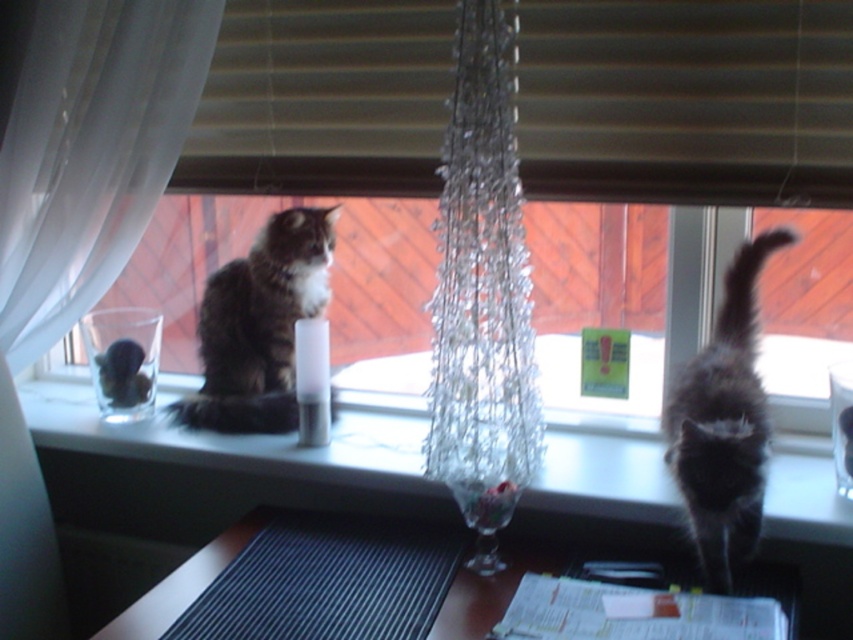
Question: Based on their relative distances, which object is farther from the dark brown fur cat at center?

Choices:
 (A) black fluffy cat at right
 (B) white sheer curtain at upper left
 (C) brown wooden blind at upper center

Answer: (A)

Question: Among these points, which one is farthest from the camera?

Choices:
 (A) (x=320, y=241)
 (B) (x=341, y=42)
 (C) (x=556, y=28)

Answer: (A)

Question: Is white sheer curtain at upper left bigger than black fluffy cat at right?

Choices:
 (A) yes
 (B) no

Answer: (A)

Question: Is clear glass candle at center to the right of dark brown fur cat at center from the viewer's perspective?

Choices:
 (A) yes
 (B) no

Answer: (A)

Question: Which point is farther to the camera?

Choices:
 (A) dark brown fur cat at center
 (B) clear glass candle at center
 (C) white smooth window sill at center
 (D) black fluffy cat at right

Answer: (A)

Question: Can you confirm if dark brown fur cat at center is positioned above wooden table at lower center?

Choices:
 (A) yes
 (B) no

Answer: (A)